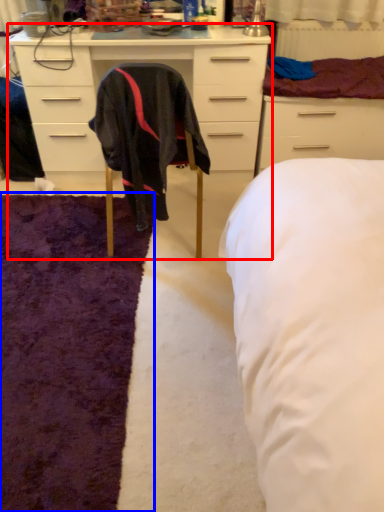
Question: Which point is further to the camera, cabinetry (highlighted by a red box) or mat (highlighted by a blue box)?

Choices:
 (A) cabinetry
 (B) mat

Answer: (A)